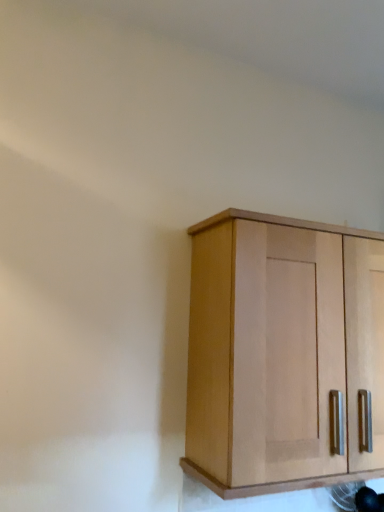
I want to click on light wood cabinet at upper right, so click(x=274, y=354).

What do you see at coordinates (274, 354) in the screenshot?
I see `light wood cabinet at upper right` at bounding box center [274, 354].

At what (x,y) coordinates should I click in order to perform the action: click on light wood cabinet at upper right. Please return your answer as a coordinate pair (x, y). This screenshot has height=512, width=384. Looking at the image, I should click on (274, 354).